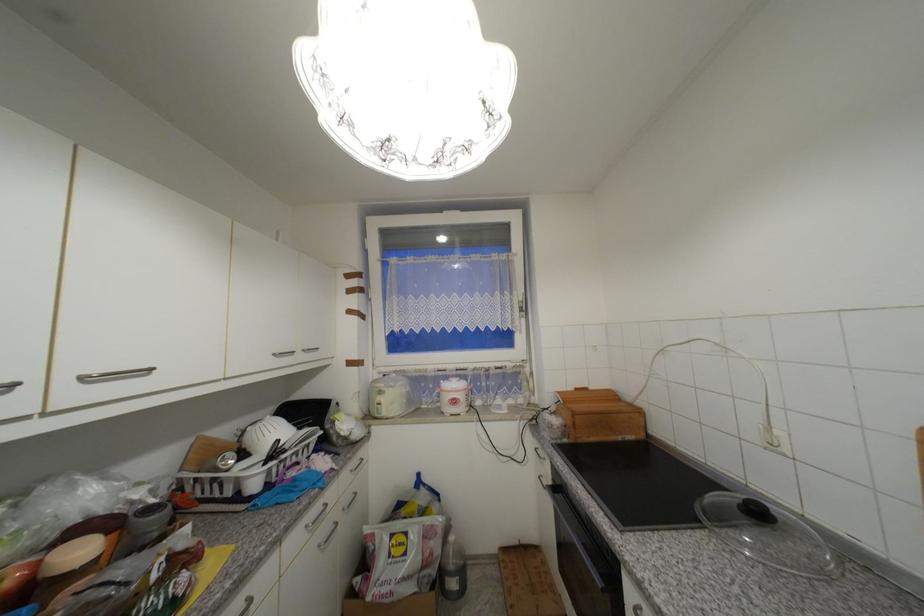
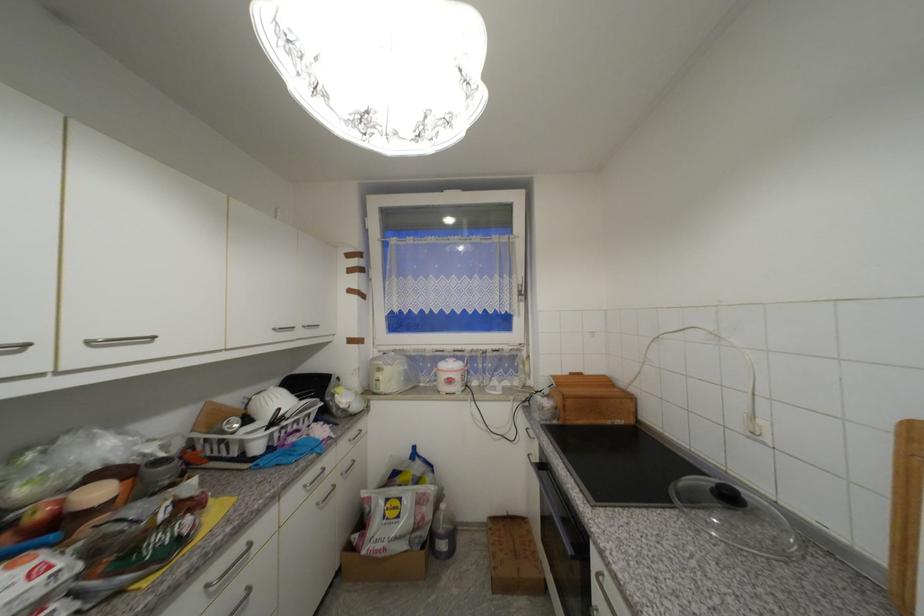
In the second image, find the point that corresponds to (386,394) in the first image.

(385, 371)